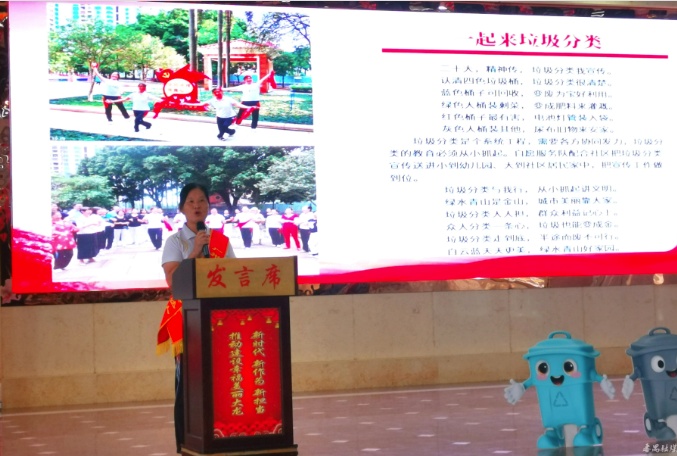
The width and height of the screenshot is (677, 456). I want to click on gold chinese characters on the front of a red podium, so click(234, 352), click(261, 376).